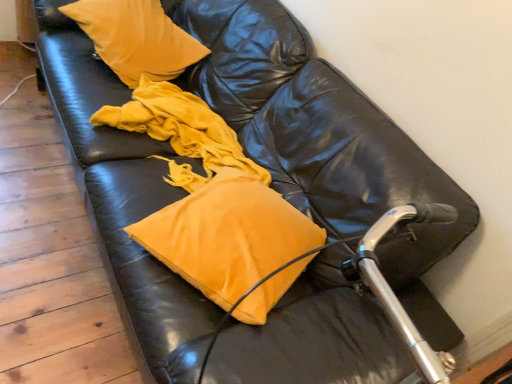
Question: Considering the relative positions of matte yellow pillow at center, acting as the first pillow starting from the front, and matte yellow pillow at center in the image provided, is matte yellow pillow at center, acting as the first pillow starting from the front, to the right of matte yellow pillow at center from the viewer's perspective?

Choices:
 (A) yes
 (B) no

Answer: (A)

Question: Is matte yellow pillow at center, the 1th pillow positioned from the bottom, closer to the viewer compared to matte yellow pillow at center?

Choices:
 (A) yes
 (B) no

Answer: (A)

Question: From a real-world perspective, is matte yellow pillow at center, marked as the second pillow in a top-to-bottom arrangement, located beneath matte yellow pillow at center?

Choices:
 (A) yes
 (B) no

Answer: (B)

Question: Can you confirm if matte yellow pillow at center, positioned as the second pillow in back-to-front order, is thinner than matte yellow pillow at center?

Choices:
 (A) no
 (B) yes

Answer: (B)

Question: Is matte yellow pillow at center, the 1th pillow positioned from the bottom, smaller than matte yellow pillow at center?

Choices:
 (A) no
 (B) yes

Answer: (B)

Question: Can you confirm if matte yellow pillow at center, marked as the second pillow in a top-to-bottom arrangement, is shorter than matte yellow pillow at center?

Choices:
 (A) yes
 (B) no

Answer: (A)

Question: From a real-world perspective, is matte yellow pillow at center positioned under velvet yellow pillow at upper left, marked as the 2th pillow in a front-to-back arrangement, based on gravity?

Choices:
 (A) yes
 (B) no

Answer: (A)

Question: Can you confirm if matte yellow pillow at center is thinner than velvet yellow pillow at upper left, which ranks as the 1th pillow in top-to-bottom order?

Choices:
 (A) yes
 (B) no

Answer: (B)

Question: From a real-world perspective, is matte yellow pillow at center over velvet yellow pillow at upper left, marked as the 2th pillow in a front-to-back arrangement?

Choices:
 (A) yes
 (B) no

Answer: (B)

Question: Would you say matte yellow pillow at center is outside velvet yellow pillow at upper left, the 1th pillow in the back-to-front sequence?

Choices:
 (A) yes
 (B) no

Answer: (A)

Question: Is matte yellow pillow at center positioned far away from velvet yellow pillow at upper left, the 1th pillow in the back-to-front sequence?

Choices:
 (A) yes
 (B) no

Answer: (B)

Question: Can you confirm if matte yellow pillow at center is shorter than velvet yellow pillow at upper left, marked as the 2th pillow in a front-to-back arrangement?

Choices:
 (A) yes
 (B) no

Answer: (A)

Question: Considering the relative sizes of matte yellow pillow at center, positioned as the second pillow in back-to-front order, and velvet yellow pillow at upper left, which ranks as the 1th pillow in top-to-bottom order, in the image provided, is matte yellow pillow at center, positioned as the second pillow in back-to-front order, shorter than velvet yellow pillow at upper left, which ranks as the 1th pillow in top-to-bottom order,?

Choices:
 (A) yes
 (B) no

Answer: (A)